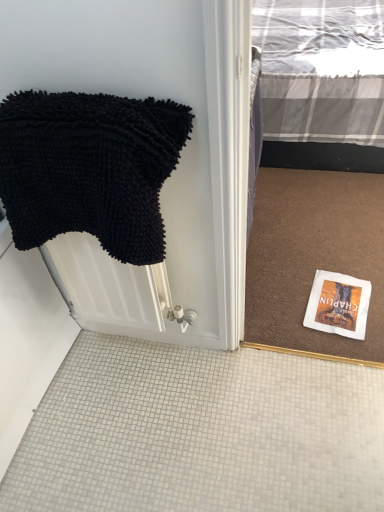
Question: From the image's perspective, is white paper book cover at lower right located above or below black chenille towel at left?

Choices:
 (A) below
 (B) above

Answer: (A)

Question: From a real-world perspective, relative to black chenille towel at left, is white paper book cover at lower right vertically above or below?

Choices:
 (A) below
 (B) above

Answer: (A)

Question: In the image, is white paper book cover at lower right positioned in front of or behind black chenille towel at left?

Choices:
 (A) behind
 (B) front

Answer: (A)

Question: Considering the positions of black chenille towel at left and white paper book cover at lower right in the image, is black chenille towel at left taller or shorter than white paper book cover at lower right?

Choices:
 (A) short
 (B) tall

Answer: (B)

Question: From the image's perspective, relative to white paper book cover at lower right, is black chenille towel at left above or below?

Choices:
 (A) below
 (B) above

Answer: (B)

Question: In the image, is black chenille towel at left positioned in front of or behind white paper book cover at lower right?

Choices:
 (A) front
 (B) behind

Answer: (A)

Question: Is black chenille towel at left to the left or to the right of white paper book cover at lower right in the image?

Choices:
 (A) right
 (B) left

Answer: (B)